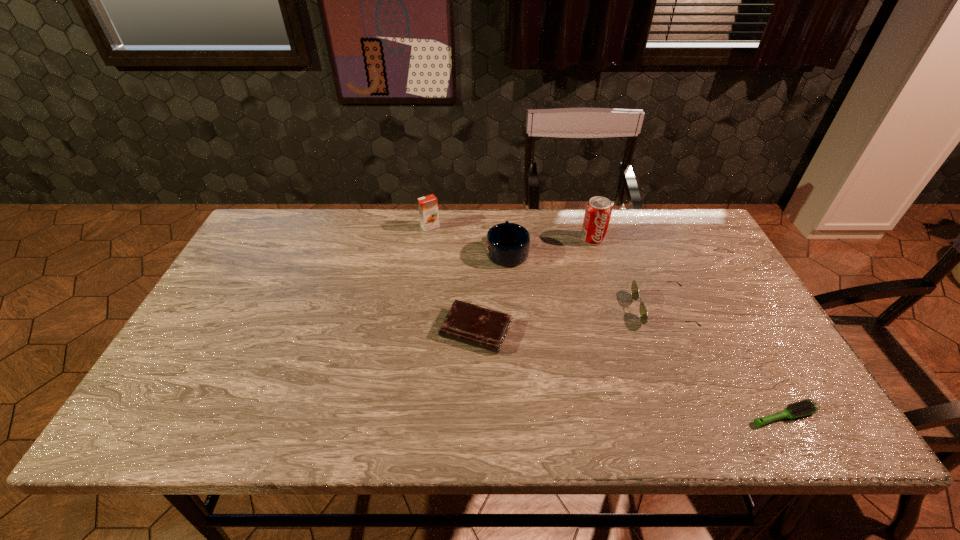
Locate an element on the screen. vacant area located on the back of the tallest object is located at coordinates (586, 217).

Find the location of a particular element. vacant space located 0.070m on the left of the orange juice is located at coordinates (399, 226).

Image resolution: width=960 pixels, height=540 pixels. Find the location of `vacant space located with the handle on the side of the third tallest object`. vacant space located with the handle on the side of the third tallest object is located at coordinates (505, 216).

In order to click on free region located with the handle on the side of the third tallest object in this screenshot , I will do `click(505, 221)`.

This screenshot has width=960, height=540. I want to click on vacant point located 0.260m on the front-facing side of the fifth object from left to right, so click(539, 309).

The image size is (960, 540). I want to click on free space located on the front-facing side of the fifth object from left to right, so click(x=568, y=309).

Locate an element on the screen. The image size is (960, 540). free point located on the front-facing side of the fifth object from left to right is located at coordinates (599, 309).

At what (x,y) coordinates should I click in order to perform the action: click on vacant area situated 0.350m on the left of the diary. Please return your answer as a coordinate pair (x, y). Image resolution: width=960 pixels, height=540 pixels. Looking at the image, I should click on (301, 330).

This screenshot has width=960, height=540. In order to click on free space located on the back of the rightmost object in this screenshot , I will do `click(732, 324)`.

What are the coordinates of `soda can situated at the far edge` in the screenshot? It's located at (598, 211).